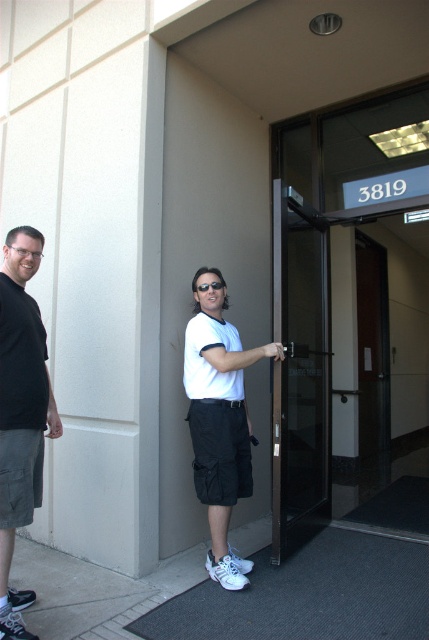
You are a delivery person trying to enter the building through the entrance. The black glass door at center is the only entrance available. However, you notice the black cotton shirt at left might be blocking your path. Can you still enter through the door?

The black glass door at center is larger in size than the black cotton shirt at left, so the door is wide enough to allow entry even if the black cotton shirt at left is nearby. You can still enter through the door.

You are standing at the entrance of the building and want to enter through the black glass door at center. However, you notice sunglasses at center in your way. Can you walk through the door without moving the sunglasses?

The black glass door at center is below sunglasses at center, so the sunglasses are blocking the entrance. You will need to move the sunglasses to access the door.

You are standing in front of the building entrance and want to take a photo of the two people. You notice two points marked on the ground at coordinates point (302,365) and point (214,284). Which point should you stand on to ensure both people are in focus without adjusting your camera settings?

You should stand on point (214,284) because it is closer to the camera, allowing both people to be in focus simultaneously.